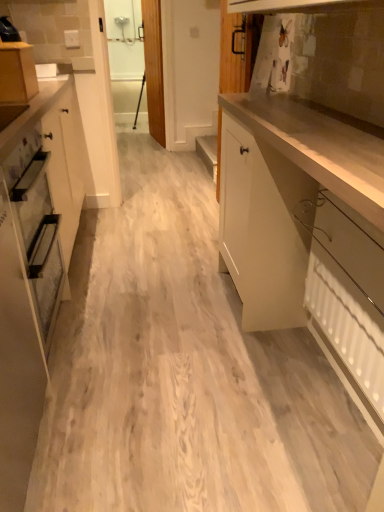
Find the location of a particular element. Image resolution: width=384 pixels, height=512 pixels. unoccupied space behind glossy white cabinet at right, the 3th cabinetry positioned from the left is located at coordinates (172, 257).